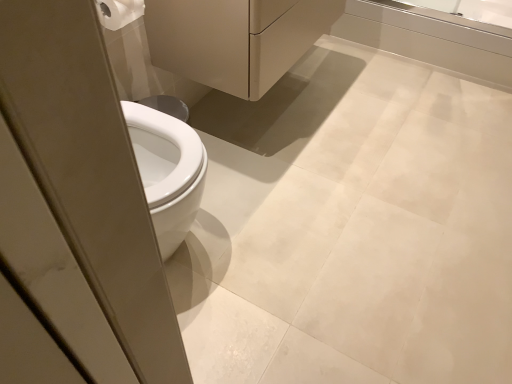
Question: Is matte white porcelain at center wider or thinner than white matte toilet paper at upper left?

Choices:
 (A) thin
 (B) wide

Answer: (B)

Question: From the image's perspective, is matte white porcelain at center above or below white matte toilet paper at upper left?

Choices:
 (A) below
 (B) above

Answer: (B)

Question: Based on their relative distances, which object is nearer to the matte white porcelain at center?

Choices:
 (A) white matte toilet paper at upper left
 (B) transparent glass screen door at left
 (C) white glossy bathtub at upper right

Answer: (A)

Question: Which object is positioned farthest from the transparent glass screen door at left?

Choices:
 (A) white glossy bathtub at upper right
 (B) white matte toilet paper at upper left
 (C) matte white porcelain at center

Answer: (A)